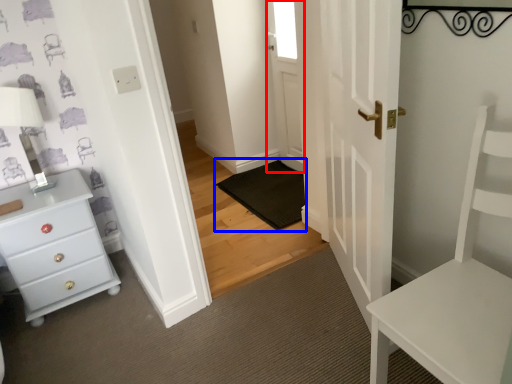
Question: Which point is further to the camera, door (highlighted by a red box) or doormat (highlighted by a blue box)?

Choices:
 (A) door
 (B) doormat

Answer: (A)